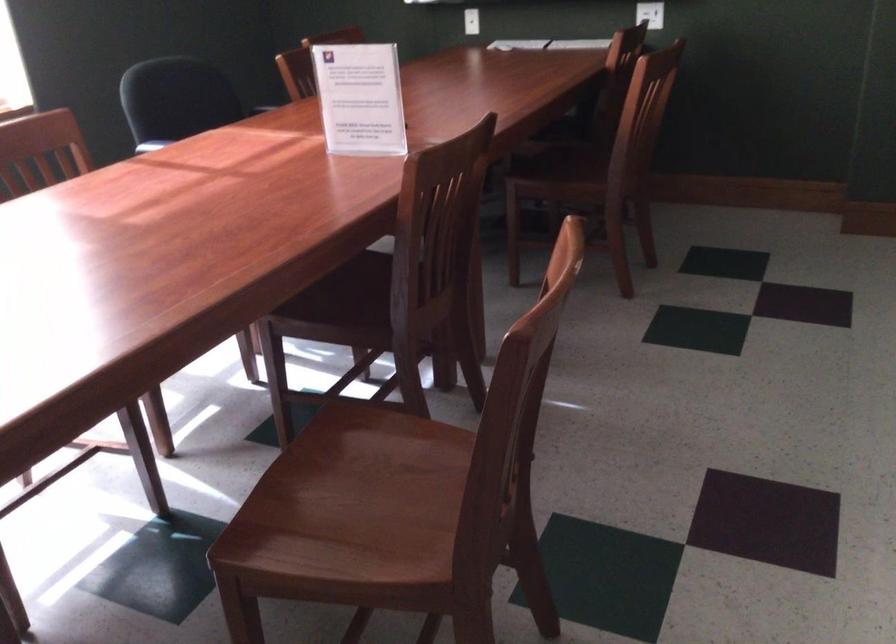
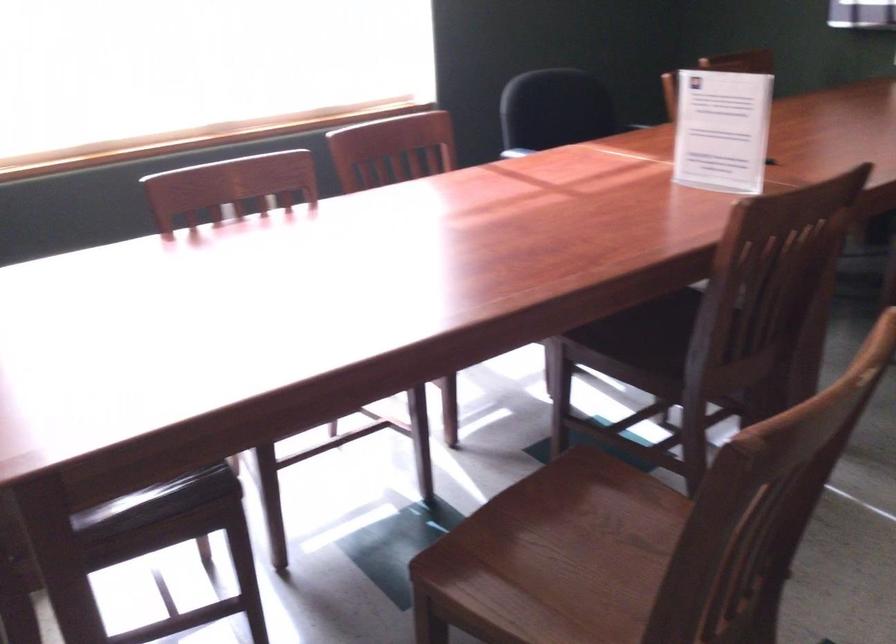
Question: How did the camera likely rotate?

Choices:
 (A) Left
 (B) Right
 (C) Up
 (D) Down

Answer: (A)